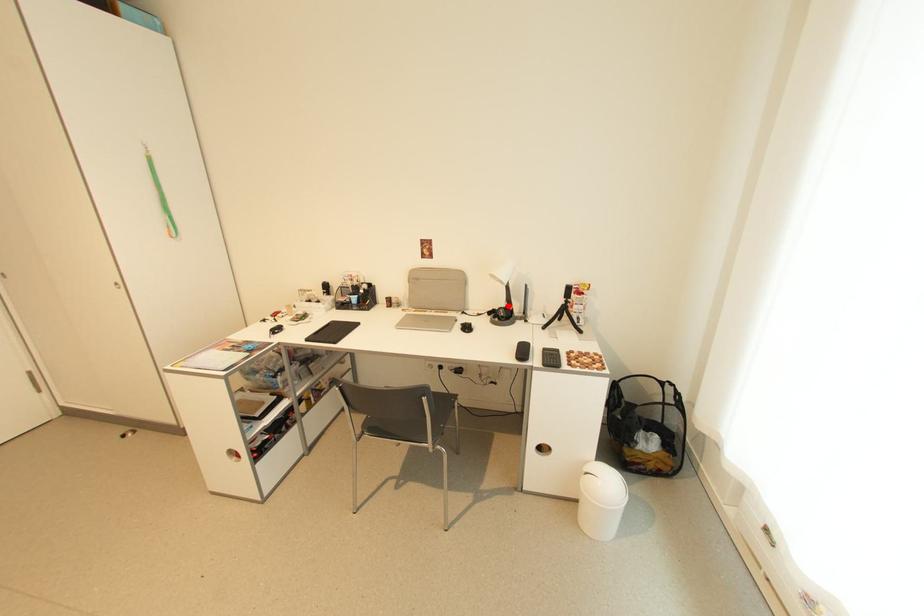
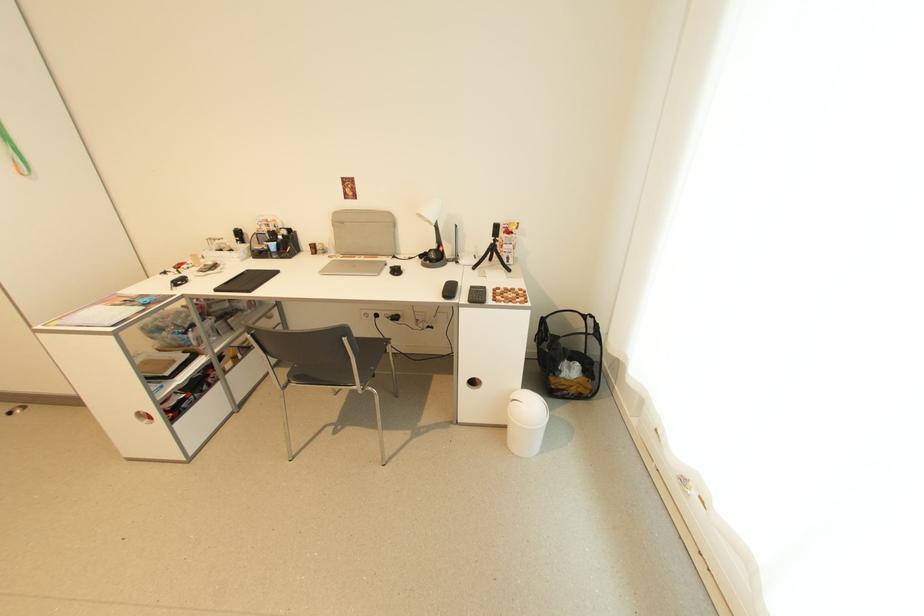
Locate, in the second image, the point that corresponds to the highlighted location in the first image.

(439, 248)